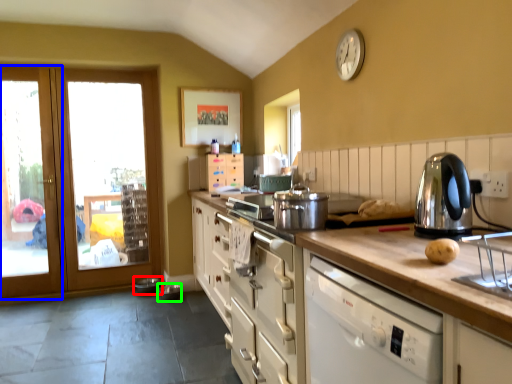
Question: Which object is positioned farthest from appliance (highlighted by a red box)? Select from screen door (highlighted by a blue box) and appliance (highlighted by a green box).

Choices:
 (A) screen door
 (B) appliance

Answer: (A)